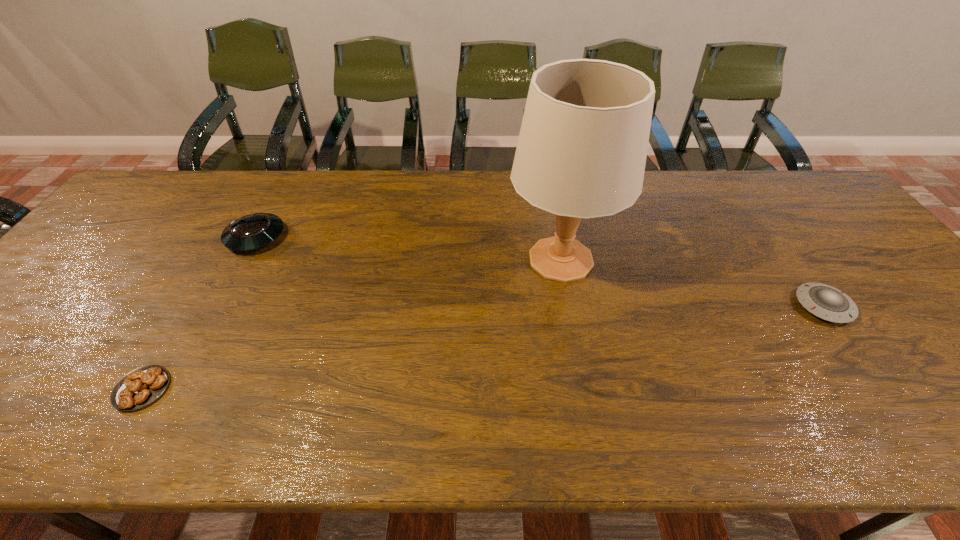
This screenshot has height=540, width=960. What are the coordinates of `vacant point located between the left saucer and the tallest object` in the screenshot? It's located at (408, 248).

This screenshot has height=540, width=960. Find the location of `free space between the nearer saucer and the nearest object`. free space between the nearer saucer and the nearest object is located at coordinates (483, 347).

Where is `vacant space that's between the right saucer and the pastry`? The width and height of the screenshot is (960, 540). vacant space that's between the right saucer and the pastry is located at coordinates (483, 347).

Identify which object is located as the third nearest to the second tallest object. Please provide its 2D coordinates. Your answer should be formatted as a tuple, i.e. [(x, y)], where the tuple contains the x and y coordinates of a point satisfying the conditions above.

[(824, 301)]

Locate which object is the second closest to the tallest object. Please provide its 2D coordinates. Your answer should be formatted as a tuple, i.e. [(x, y)], where the tuple contains the x and y coordinates of a point satisfying the conditions above.

[(254, 231)]

The width and height of the screenshot is (960, 540). Identify the location of free space that satisfies the following two spatial constraints: 1. on the back side of the third object from left to right; 2. on the right side of the shortest object. (219, 260).

This screenshot has height=540, width=960. What are the coordinates of `blank space that satisfies the following two spatial constraints: 1. on the back side of the nearest object; 2. on the right side of the tallest object` in the screenshot? It's located at (219, 260).